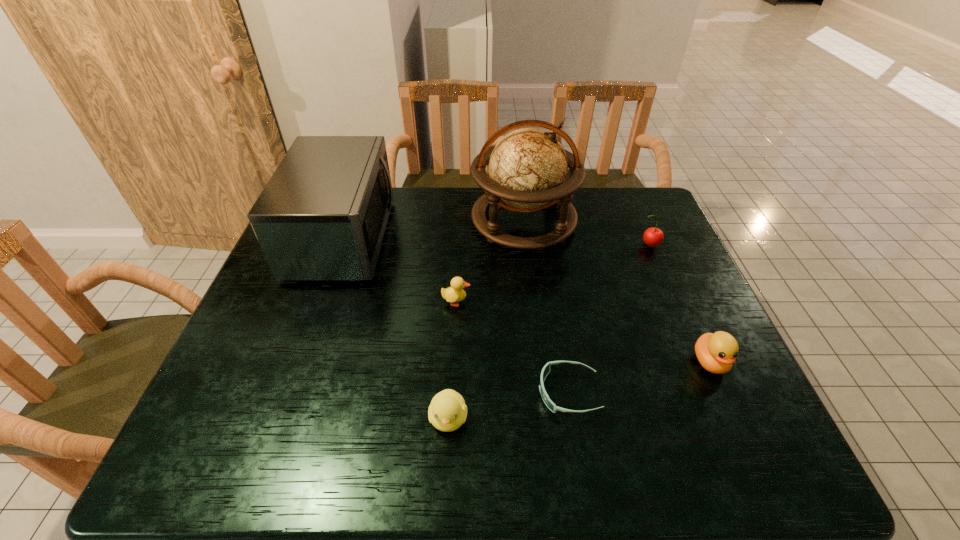
This screenshot has height=540, width=960. Identify the location of the closest duckling relative to the second farthest duckling. pyautogui.click(x=447, y=412).

At what (x,y) coordinates should I click in order to perform the action: click on duckling that stands as the second closest to the shortest object. Please return your answer as a coordinate pair (x, y). The image size is (960, 540). Looking at the image, I should click on (716, 352).